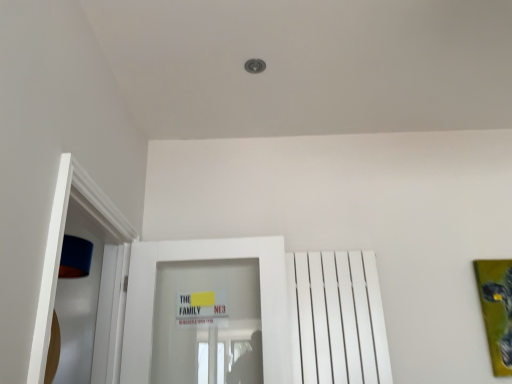
Question: Considering the positions of white glossy door at center and white matte radiator at right in the image, is white glossy door at center wider or thinner than white matte radiator at right?

Choices:
 (A) thin
 (B) wide

Answer: (B)

Question: From a real-world perspective, is white glossy door at center positioned above or below white matte radiator at right?

Choices:
 (A) below
 (B) above

Answer: (B)

Question: Which of these objects is positioned farthest from the green matte painting at right?

Choices:
 (A) white matte radiator at right
 (B) white glossy door at center

Answer: (B)

Question: Estimate the real-world distances between objects in this image. Which object is closer to the green matte painting at right?

Choices:
 (A) white matte radiator at right
 (B) white glossy door at center

Answer: (A)